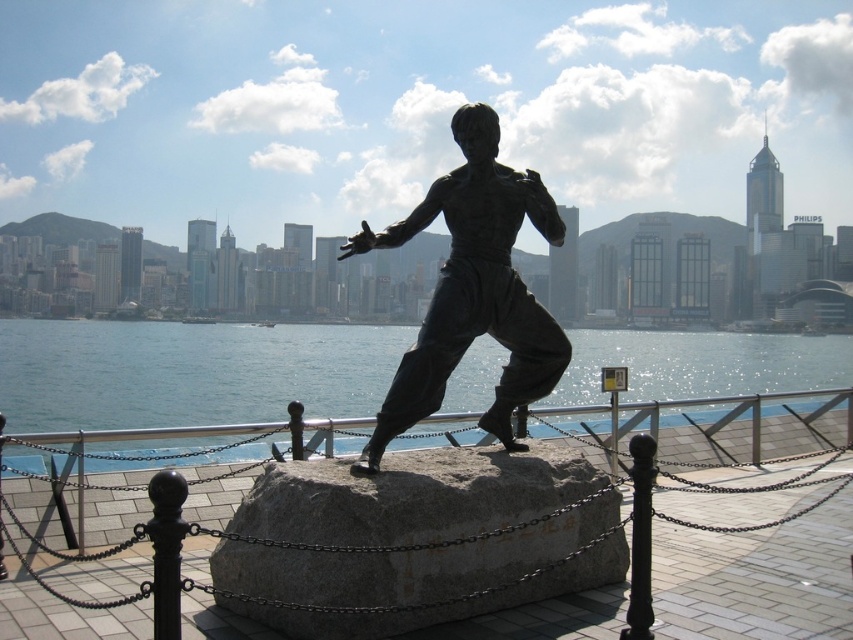
Based on the photo, you are standing at the entrance of the monument area and want to place a new plaque at the exact center of the gray granite stone at center. According to the coordinates provided, where should you place the plaque?

The plaque should be placed at the coordinates point [413,496] on the gray granite stone at center as specified.

You are standing in front of the statue and want to locate the clear blue water at center. According to the coordinates provided, where should you look relative to the statue?

The clear blue water at center is located at coordinates point (186, 371), which is to the right and slightly above the statue.